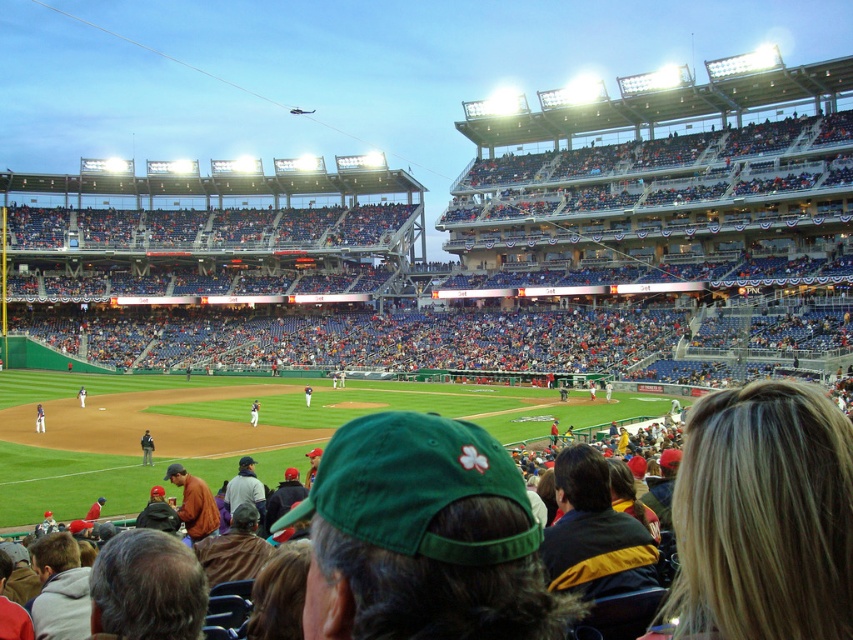
You are a photographer trying to capture a photo of the white jersey at center and the white uniform at center from your current position. Which one will appear larger in the photo?

The white jersey at center will appear larger in the photo because it is closer to the viewer than the white uniform at center.

You are a photographer at the baseball game and want to capture a photo that includes both the dark gray uniform at center and the green fabric baseball cap at center. Based on their positions, which object should appear lower in the photo?

The dark gray uniform at center is located below the green fabric baseball cap at center, so in the photo, the dark gray uniform at center will appear lower than the green fabric baseball cap at center.

You are a photographer at the baseball game and want to capture both the white jersey at center and the white uniform at center in a single photo. Since both are white, you need to use their height difference to distinguish them. Which one should you focus on first to ensure it appears taller in the photo?

The white jersey at center is taller than the white uniform at center, so you should focus on the white jersey at center first to ensure it appears taller in the photo.